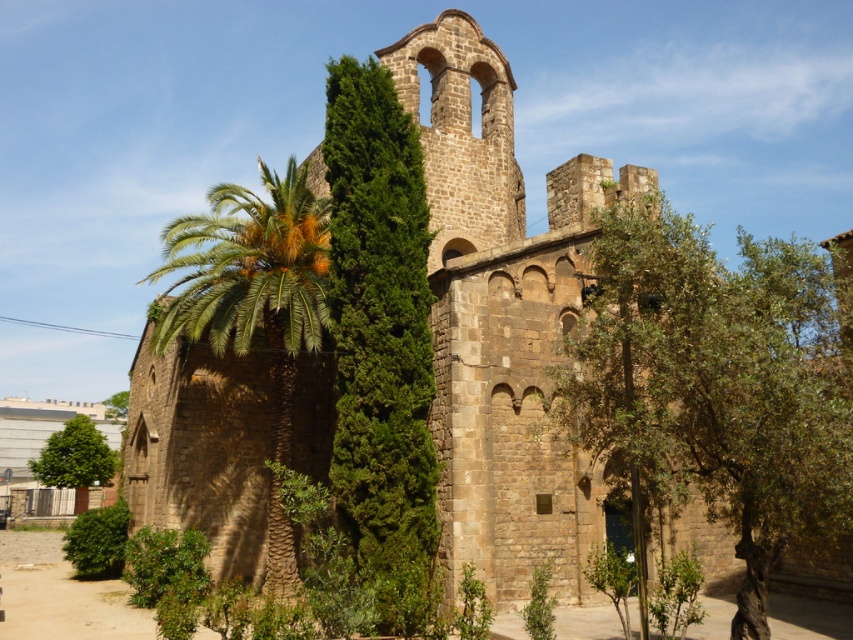
Question: Estimate the real-world distances between objects in this image. Which object is farther from the green leafy tree at right?

Choices:
 (A) green textured tree at center
 (B) green leafy palm at left

Answer: (B)

Question: Is green leafy tree at right smaller than green leafy palm at left?

Choices:
 (A) no
 (B) yes

Answer: (B)

Question: Can you confirm if green leafy tree at right is bigger than green leafy palm at left?

Choices:
 (A) yes
 (B) no

Answer: (B)

Question: Which object appears closest to the camera in this image?

Choices:
 (A) green textured tree at center
 (B) green leafy tree at lower left
 (C) green leafy palm at left

Answer: (A)

Question: Can you confirm if green textured tree at center is positioned to the right of green leafy tree at lower left?

Choices:
 (A) no
 (B) yes

Answer: (B)

Question: Which object appears farthest from the camera in this image?

Choices:
 (A) green leafy tree at right
 (B) green leafy palm at left
 (C) green leafy tree at lower left

Answer: (C)